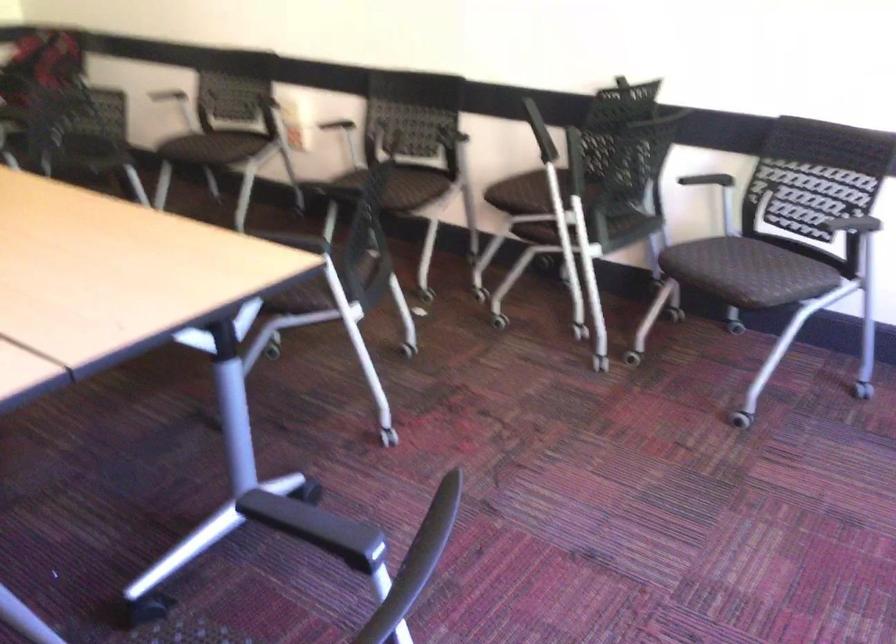
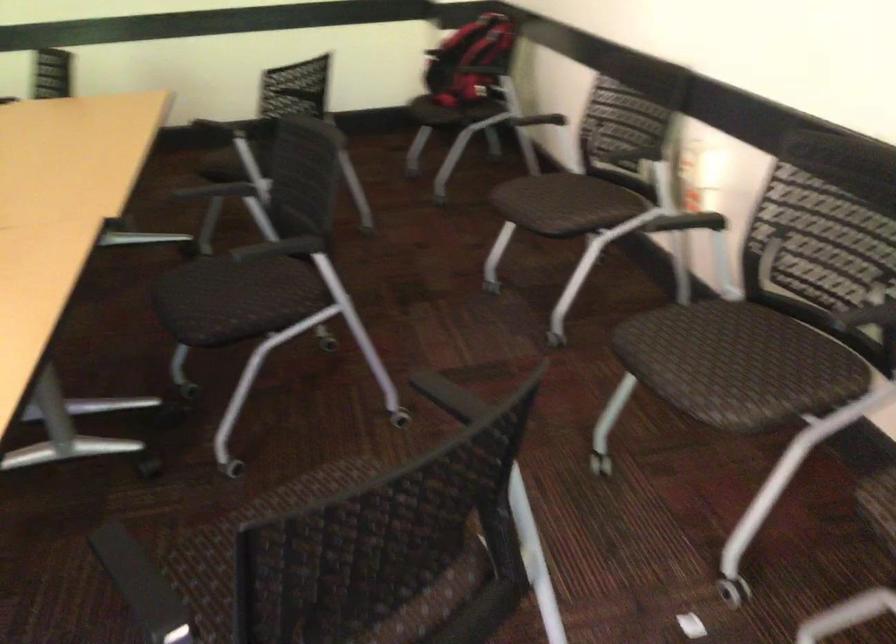
In the second image, find the point that corresponds to point 239,143 in the first image.

(581, 207)